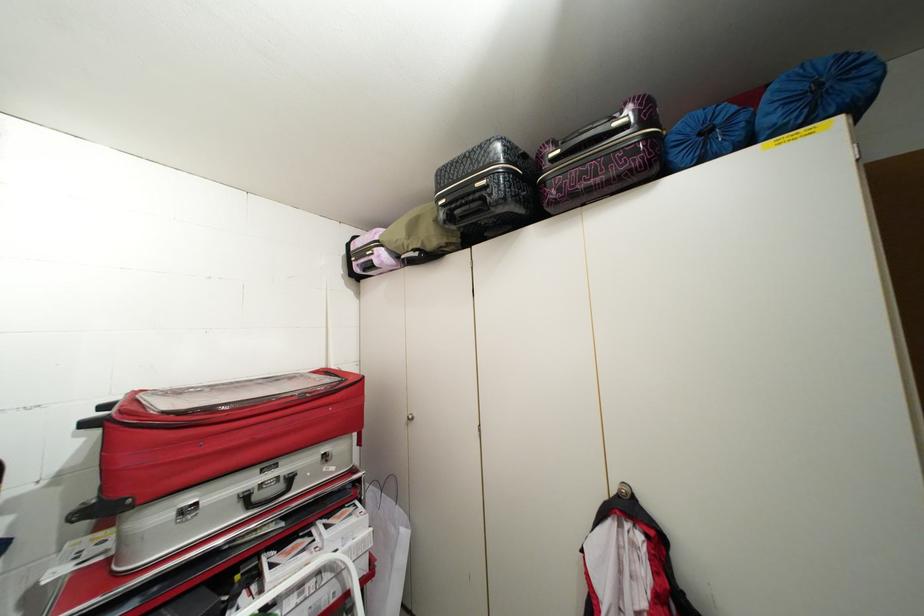
What do you see at coordinates (624, 491) in the screenshot? I see `a metal door hook` at bounding box center [624, 491].